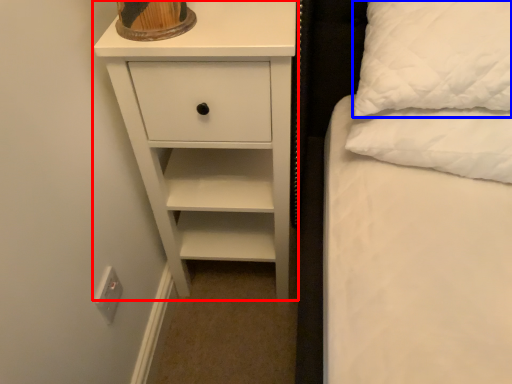
Question: Which point is closer to the camera, chest of drawers (highlighted by a red box) or pillow (highlighted by a blue box)?

Choices:
 (A) chest of drawers
 (B) pillow

Answer: (B)